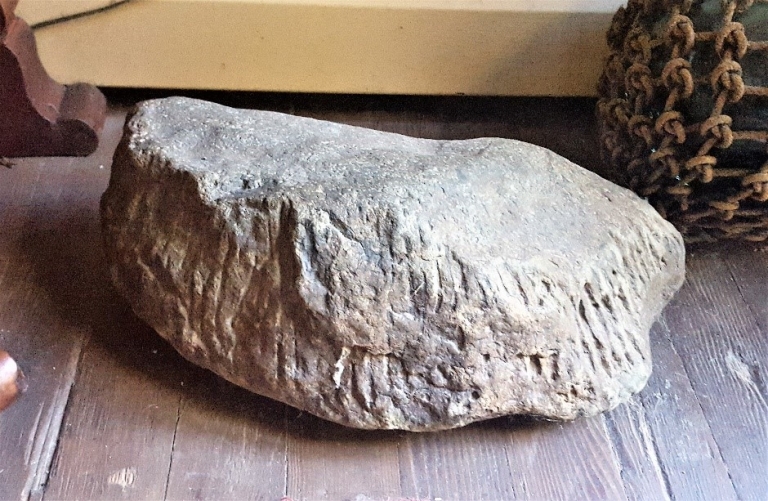
Identify the location of table base. The width and height of the screenshot is (768, 501). (25, 142).